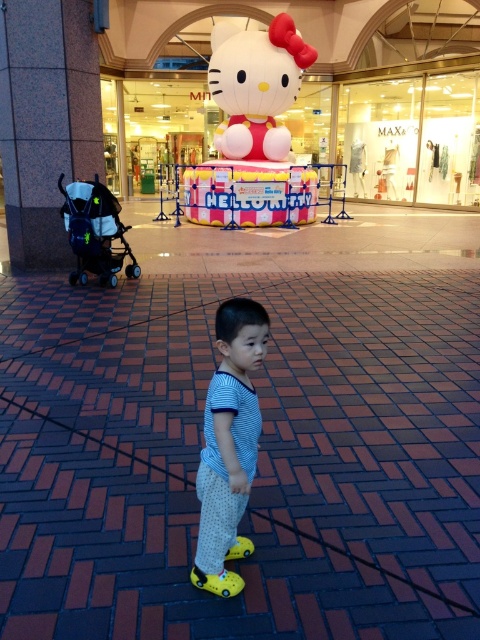
Question: Is marble pillar at left positioned before black matte baby carriage at left?

Choices:
 (A) yes
 (B) no

Answer: (B)

Question: Which point is closer to the camera?

Choices:
 (A) marble pillar at left
 (B) white matte hello kitty at upper center

Answer: (A)

Question: Which object is the farthest from the white matte hello kitty at upper center?

Choices:
 (A) striped fabric shirt at center
 (B) marble pillar at left

Answer: (A)

Question: Is marble pillar at left wider than striped fabric shirt at center?

Choices:
 (A) yes
 (B) no

Answer: (A)

Question: Which point is closer to the camera taking this photo?

Choices:
 (A) (93, 225)
 (B) (277, 90)
 (C) (57, 22)
 (D) (211, 515)

Answer: (D)

Question: Does marble pillar at left have a greater width compared to striped fabric shirt at center?

Choices:
 (A) yes
 (B) no

Answer: (A)